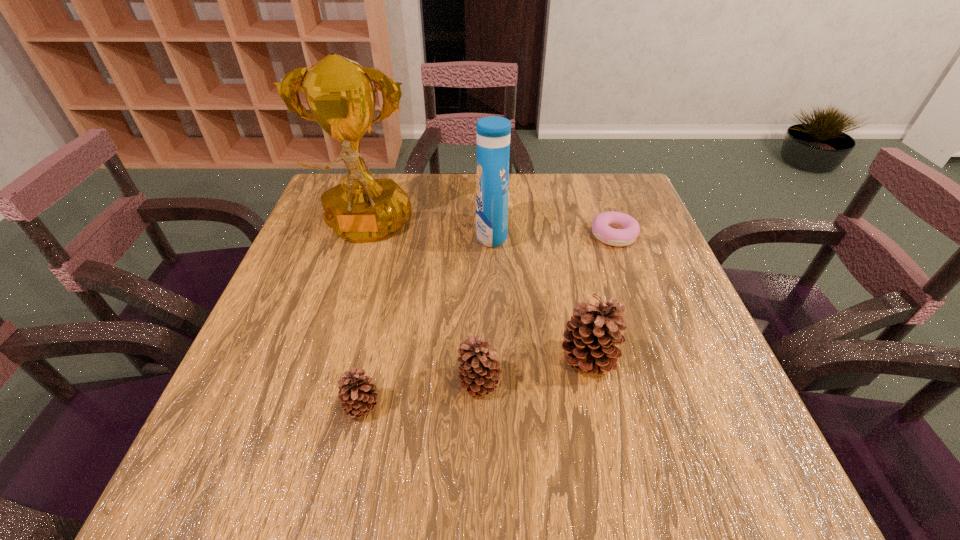
Locate an element on the screen. The width and height of the screenshot is (960, 540). pinecone object that ranks as the second closest to the fourth tallest object is located at coordinates (356, 393).

Find the location of a particular element. The image size is (960, 540). vacant space that satisfies the following two spatial constraints: 1. on the front side of the award; 2. on the left side of the shortest object is located at coordinates (363, 235).

Identify the location of vacant space that satisfies the following two spatial constraints: 1. on the front side of the second object from right to left; 2. on the right side of the award. (324, 360).

The height and width of the screenshot is (540, 960). I want to click on vacant area that satisfies the following two spatial constraints: 1. on the back side of the fourth tallest object; 2. on the left side of the tallest pinecone, so click(480, 360).

Locate an element on the screen. This screenshot has width=960, height=540. vacant space that satisfies the following two spatial constraints: 1. on the back side of the shortest pinecone; 2. on the left side of the rightmost pinecone is located at coordinates 372,360.

I want to click on vacant space that satisfies the following two spatial constraints: 1. on the back side of the fourth tallest object; 2. on the right side of the second object from right to left, so (480, 360).

Locate an element on the screen. This screenshot has height=540, width=960. blank space that satisfies the following two spatial constraints: 1. on the back side of the fourth tallest object; 2. on the right side of the fourth shortest object is located at coordinates (480, 360).

At what (x,y) coordinates should I click in order to perform the action: click on vacant space that satisfies the following two spatial constraints: 1. on the front-facing side of the rightmost object; 2. on the right side of the second tallest object. Please return your answer as a coordinate pair (x, y). The width and height of the screenshot is (960, 540). Looking at the image, I should click on (492, 235).

You are a GUI agent. You are given a task and a screenshot of the screen. Output one action in this format:
    pyautogui.click(x=<x>, y=<y>)
    Task: Click on the vacant space that satisfies the following two spatial constraints: 1. on the back side of the second shortest pinecone; 2. on the left side of the shortest object
    The height and width of the screenshot is (540, 960).
    Given the screenshot: What is the action you would take?
    pyautogui.click(x=480, y=235)

Where is `free space that satisfies the following two spatial constraints: 1. on the front side of the shortest object; 2. on the right side of the tallest object`? This screenshot has height=540, width=960. free space that satisfies the following two spatial constraints: 1. on the front side of the shortest object; 2. on the right side of the tallest object is located at coordinates (363, 235).